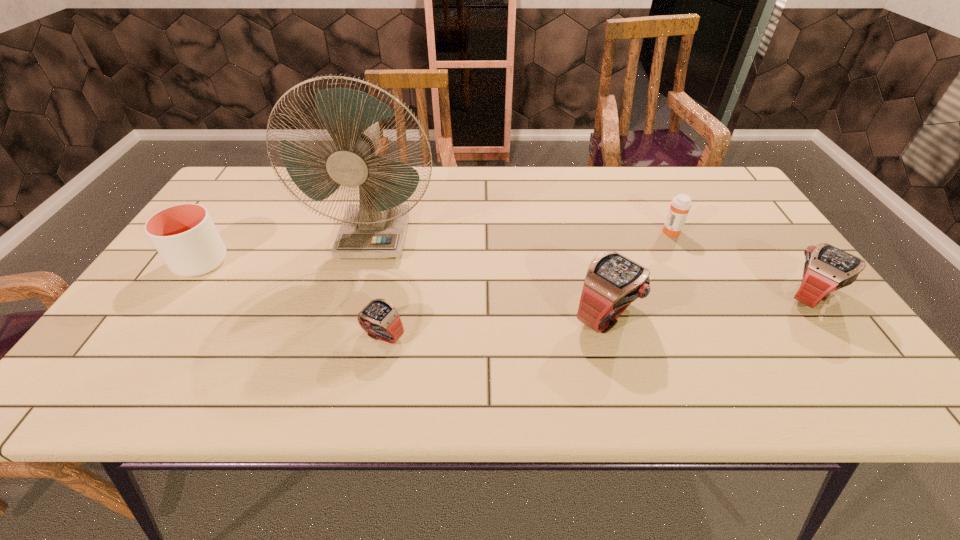
Where is `vacant region at the near left corner`? The height and width of the screenshot is (540, 960). vacant region at the near left corner is located at coordinates (128, 339).

This screenshot has height=540, width=960. In order to click on free region at the far right corner in this screenshot , I will do `click(712, 177)`.

In the image, there is a desktop. At what (x,y) coordinates should I click in order to perform the action: click on free region at the near right corner. Please return your answer as a coordinate pair (x, y). The width and height of the screenshot is (960, 540). Looking at the image, I should click on (790, 342).

Find the location of a particular element. Image resolution: width=960 pixels, height=540 pixels. empty space that is in between the medicine and the fan is located at coordinates (523, 234).

The image size is (960, 540). I want to click on vacant area between the medicine and the tallest object, so click(x=523, y=234).

I want to click on free area in between the second watch from right to left and the fan, so click(491, 276).

The width and height of the screenshot is (960, 540). I want to click on free space between the shortest watch and the fan, so click(379, 286).

This screenshot has width=960, height=540. In order to click on free space between the second tallest watch and the medicine in this screenshot , I will do `click(741, 264)`.

Image resolution: width=960 pixels, height=540 pixels. Identify the location of free space between the fan and the fifth object from left to right. (523, 234).

The height and width of the screenshot is (540, 960). I want to click on free space between the second object from right to left and the rightmost watch, so click(x=741, y=264).